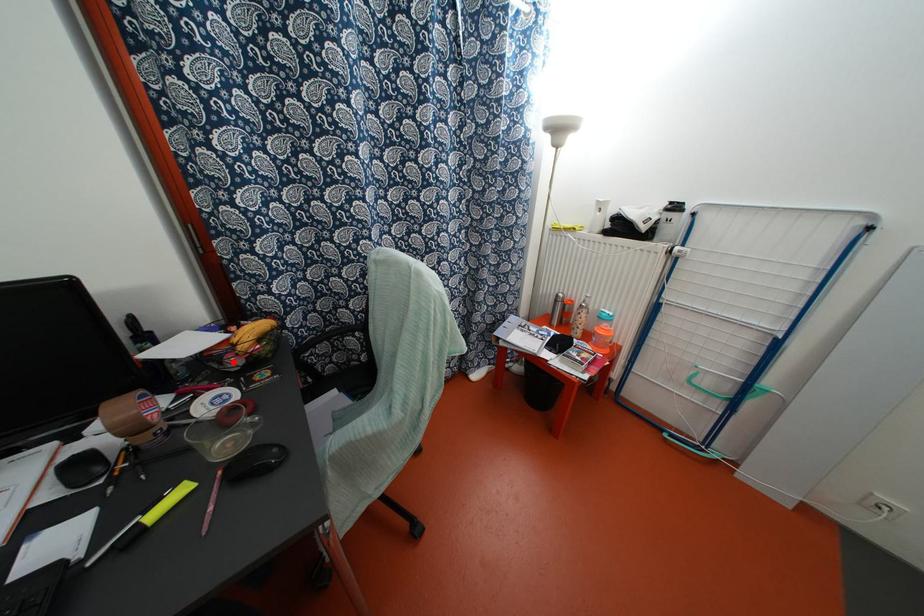
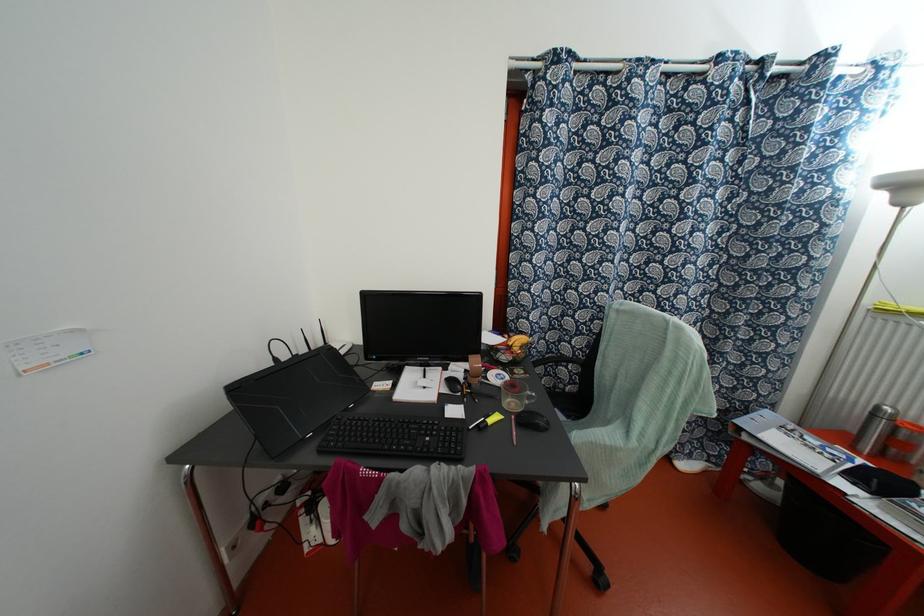
In the second image, find the point that corresponds to the highlighted location in the first image.

(504, 357)